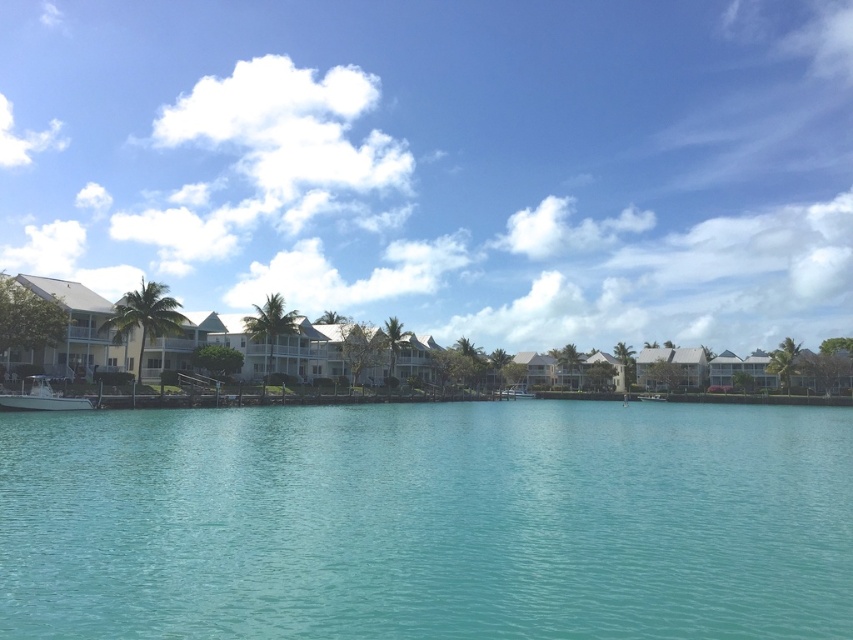
Is clear blue water at center to the right of white glossy boat at center from the viewer's perspective?

No, clear blue water at center is not to the right of white glossy boat at center.

This screenshot has width=853, height=640. I want to click on clear blue water at center, so click(x=428, y=522).

What do you see at coordinates (428, 522) in the screenshot? The height and width of the screenshot is (640, 853). I see `clear blue water at center` at bounding box center [428, 522].

Where is `clear blue water at center`? This screenshot has height=640, width=853. clear blue water at center is located at coordinates (428, 522).

Does white fiberglass boat at lower left appear over white glossy boat at center?

Yes.

This screenshot has width=853, height=640. I want to click on white fiberglass boat at lower left, so click(44, 397).

Locate an element on the screen. The image size is (853, 640). white fiberglass boat at lower left is located at coordinates (44, 397).

Locate an element on the screen. Image resolution: width=853 pixels, height=640 pixels. white fiberglass boat at lower left is located at coordinates (44, 397).

Does clear blue water at center have a greater height compared to white fiberglass boat at lower left?

Correct, clear blue water at center is much taller as white fiberglass boat at lower left.

Can you confirm if clear blue water at center is thinner than white fiberglass boat at lower left?

No, clear blue water at center is not thinner than white fiberglass boat at lower left.

Between point (54, 458) and point (76, 397), which one is positioned in front?

Positioned in front is point (54, 458).

Where is `clear blue water at center`? This screenshot has width=853, height=640. clear blue water at center is located at coordinates (428, 522).